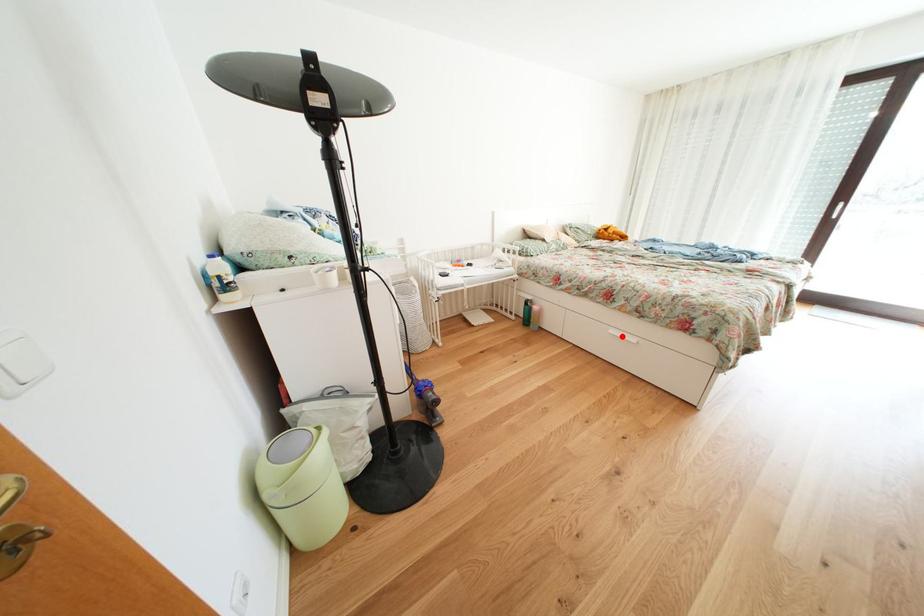
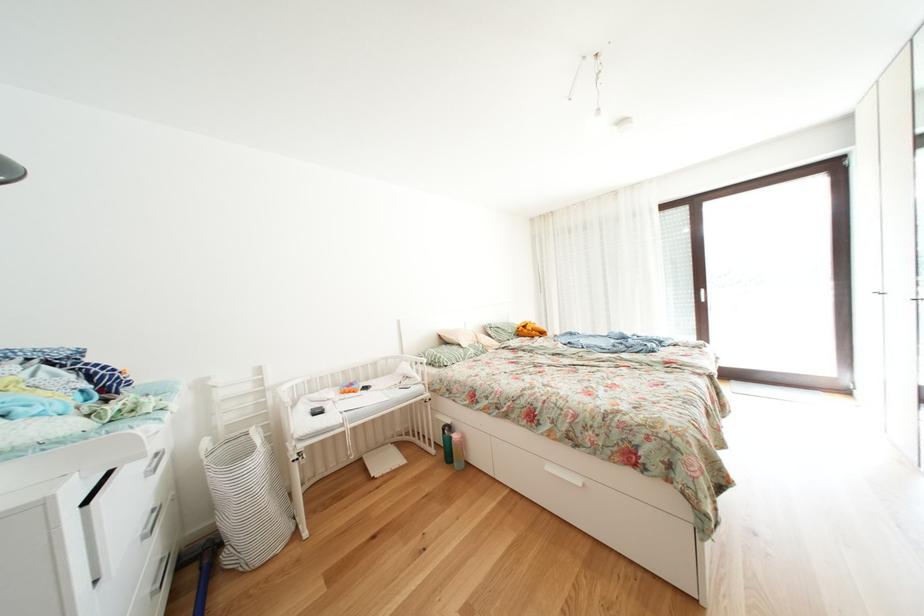
The point at the highlighted location is marked in the first image. Where is the corresponding point in the second image?

(558, 472)